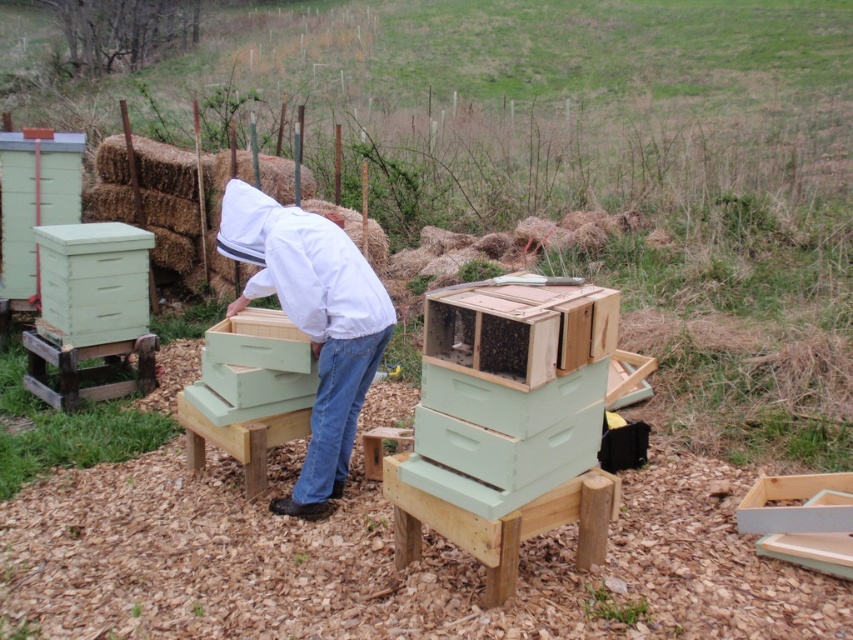
You are standing in the beekeeping area and need to reach the point marked as point (590, 445). If you can move forward 10 feet, will you be able to reach it?

The point (590, 445) is 10.30 feet from the camera. Since you can move forward 10 feet, you will not quite reach it as you need to cover an extra 0.30 feet.

You are standing in the beekeeping area and need to place a new beehive box. There are two points marked in the scene where you can place it. Which point, point (515, 481) or point (264, 214), is closer to you?

→ Point (515, 481) is closer to the viewer than point (264, 214), so you should place the new beehive box at point (515, 481).